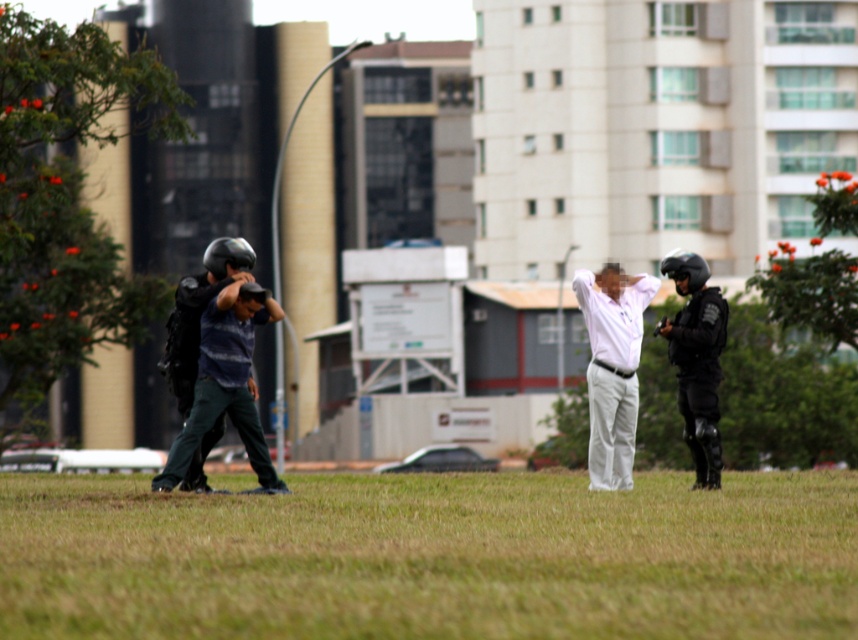
Looking at this image, between white matte shirt at center and black tactical gear at right, which one is positioned higher?

black tactical gear at right

Is point (596, 275) less distant than point (675, 253)?

No, it is not.

At what (x,y) coordinates should I click in order to perform the action: click on white matte shirt at center. Please return your answer as a coordinate pair (x, y). Looking at the image, I should click on tap(612, 369).

This screenshot has height=640, width=858. Identify the location of white matte shirt at center. (612, 369).

Is point (672, 259) positioned after point (687, 285)?

No.

Measure the distance from black tactical gear at right to black matte helmet at center.

A distance of 28.13 inches exists between black tactical gear at right and black matte helmet at center.

Which is behind, point (704, 444) or point (687, 272)?

The point (687, 272) is behind.

This screenshot has height=640, width=858. I want to click on black tactical gear at right, so click(x=696, y=360).

Is point (627, 387) less distant than point (204, 285)?

No, (627, 387) is behind (204, 285).

Is point (596, 385) less distant than point (198, 486)?

No, (596, 385) is further to viewer.

At what (x,y) coordinates should I click in order to perform the action: click on white matte shirt at center. Please return your answer as a coordinate pair (x, y). Looking at the image, I should click on (612, 369).